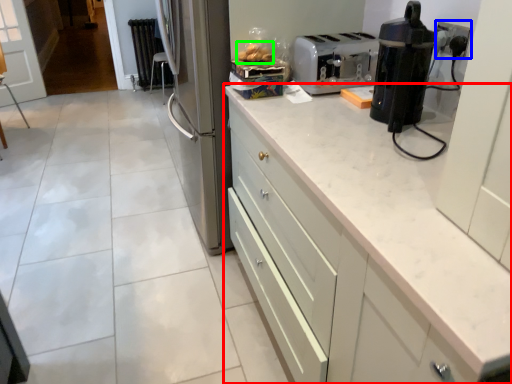
Question: Considering the real-world distances, which object is farthest from cabinetry (highlighted by a red box)? electric outlet (highlighted by a blue box) or food (highlighted by a green box)?

Choices:
 (A) electric outlet
 (B) food

Answer: (B)